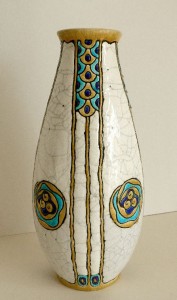
Find the location of a particular element. right vertical line on vase is located at coordinates (104, 206).